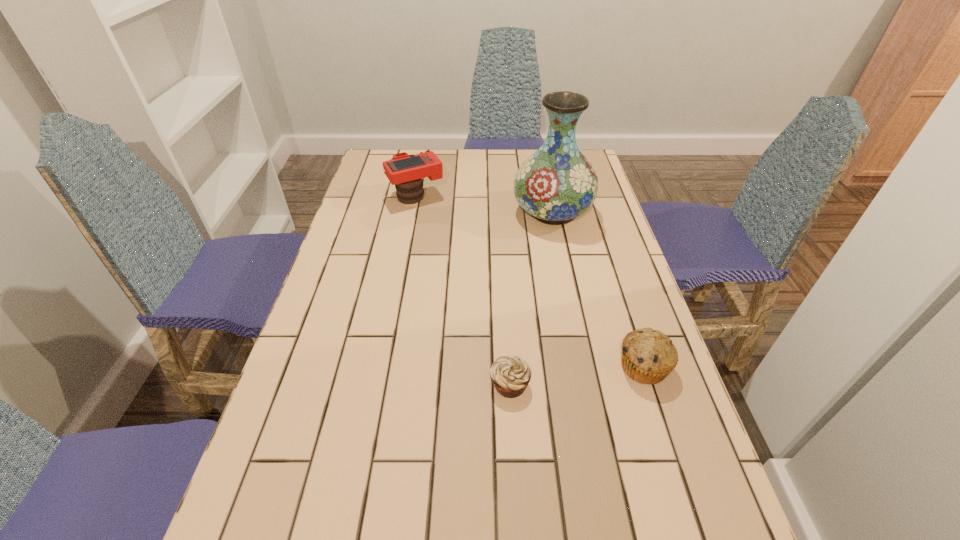
You are a GUI agent. You are given a task and a screenshot of the screen. Output one action in this format:
    pyautogui.click(x=<x>, y=<y>)
    Task: Click on the free spot between the tallest object and the third tallest object
    Image resolution: width=960 pixels, height=540 pixels.
    Given the screenshot: What is the action you would take?
    pyautogui.click(x=598, y=289)

This screenshot has height=540, width=960. I want to click on vacant area that lies between the camera and the right muffin, so click(530, 281).

At what (x,y) coordinates should I click in order to perform the action: click on unoccupied area between the left muffin and the leftmost object. Please return your answer as a coordinate pair (x, y). The image size is (960, 540). Looking at the image, I should click on (463, 290).

Find the location of a particular element. free point between the vase and the second shortest object is located at coordinates (598, 289).

Image resolution: width=960 pixels, height=540 pixels. In order to click on free area in between the right muffin and the vase in this screenshot , I will do `click(598, 289)`.

I want to click on vacant point located between the right muffin and the tallest object, so (598, 289).

Image resolution: width=960 pixels, height=540 pixels. Find the location of `empty space between the second tallest object and the taller muffin`. empty space between the second tallest object and the taller muffin is located at coordinates (530, 281).

Identify which object is located as the third nearest to the tallest object. Please provide its 2D coordinates. Your answer should be formatted as a tuple, i.e. [(x, y)], where the tuple contains the x and y coordinates of a point satisfying the conditions above.

[(510, 375)]

In order to click on object identified as the second closest to the vase in this screenshot , I will do `click(648, 356)`.

Find the location of `vacant space that satisfies the following two spatial constraints: 1. on the front side of the tallest object; 2. on the right side of the second shortest object`. vacant space that satisfies the following two spatial constraints: 1. on the front side of the tallest object; 2. on the right side of the second shortest object is located at coordinates (585, 367).